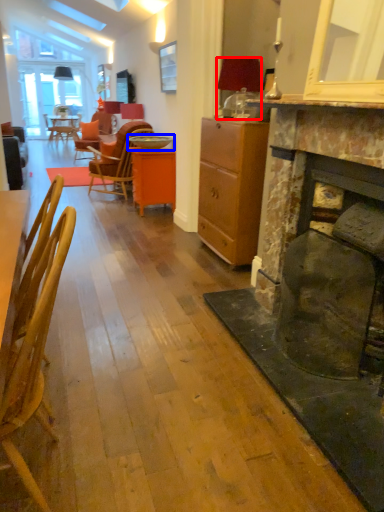
Question: Which point is closer to the camera, lamp (highlighted by a red box) or round table (highlighted by a blue box)?

Choices:
 (A) lamp
 (B) round table

Answer: (A)